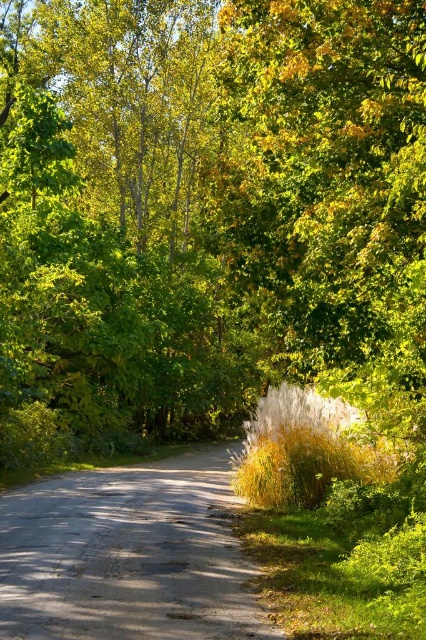
You are standing at point (207, 212) in the forest scene. What object is located exactly at your current position?

The green leafy tree at center is located exactly at point (207, 212).

You are a hiker standing on the smooth asphalt road at center. Looking at the green leafy tree at center, which object is taller?

The green leafy tree at center is taller than the smooth asphalt road at center.